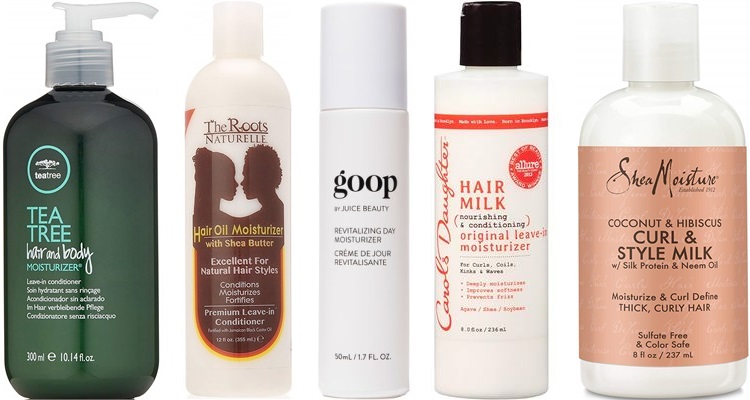
The image size is (750, 400). In order to click on bottles in this screenshot , I will do `click(82, 264)`, `click(231, 243)`, `click(378, 225)`, `click(496, 266)`, `click(661, 228)`.